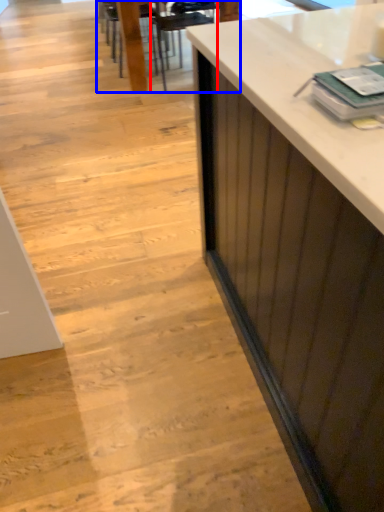
Question: Which of the following is the closest to the observer, armchair (highlighted by a red box) or table (highlighted by a blue box)?

Choices:
 (A) armchair
 (B) table

Answer: (A)